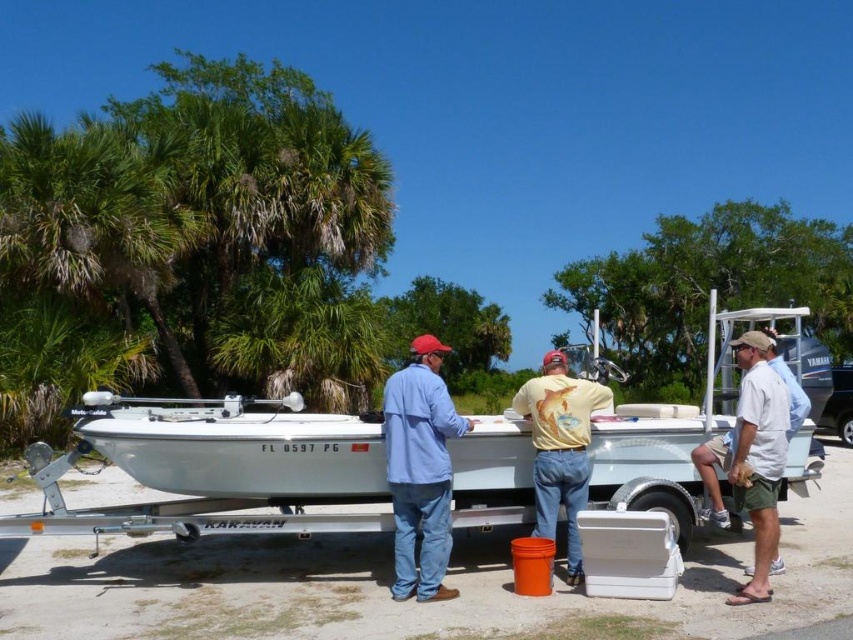
Measure the distance from blue cotton shirt at center to white cotton shirt at right.

They are 2.13 meters apart.

At what (x,y) coordinates should I click in order to perform the action: click on blue cotton shirt at center. Please return your answer as a coordinate pair (x, y). This screenshot has width=853, height=640. Looking at the image, I should click on (421, 468).

Does point (392, 474) come farther from viewer compared to point (764, 378)?

That is True.

At what (x,y) coordinates should I click in order to perform the action: click on blue cotton shirt at center. Please return your answer as a coordinate pair (x, y). The height and width of the screenshot is (640, 853). Looking at the image, I should click on (421, 468).

Can you confirm if blue cotton shirt at center is positioned below yellow t-shirt at center?

No.

Can you confirm if blue cotton shirt at center is smaller than yellow t-shirt at center?

Correct, blue cotton shirt at center occupies less space than yellow t-shirt at center.

Does point (445, 541) come closer to viewer compared to point (567, 468)?

Yes, it is.

Where is `blue cotton shirt at center`? blue cotton shirt at center is located at coordinates (421, 468).

Consider the image. Can you confirm if white cotton shirt at right is shorter than yellow t-shirt at center?

No, white cotton shirt at right is not shorter than yellow t-shirt at center.

Does white cotton shirt at right appear over yellow t-shirt at center?

Yes.

What are the coordinates of `white cotton shirt at right` in the screenshot? It's located at (752, 458).

In order to click on white cotton shirt at right in this screenshot , I will do `click(752, 458)`.